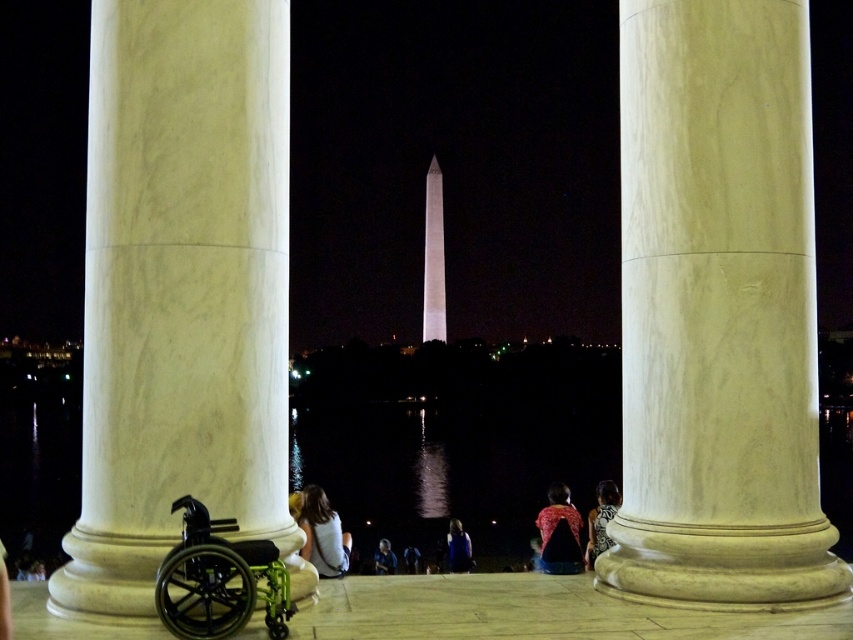
You are standing at the origin point in the image. The white marble column at center is located at coordinates point. Can you tell me its exact location?

The white marble column at center is located at point (718, 310).